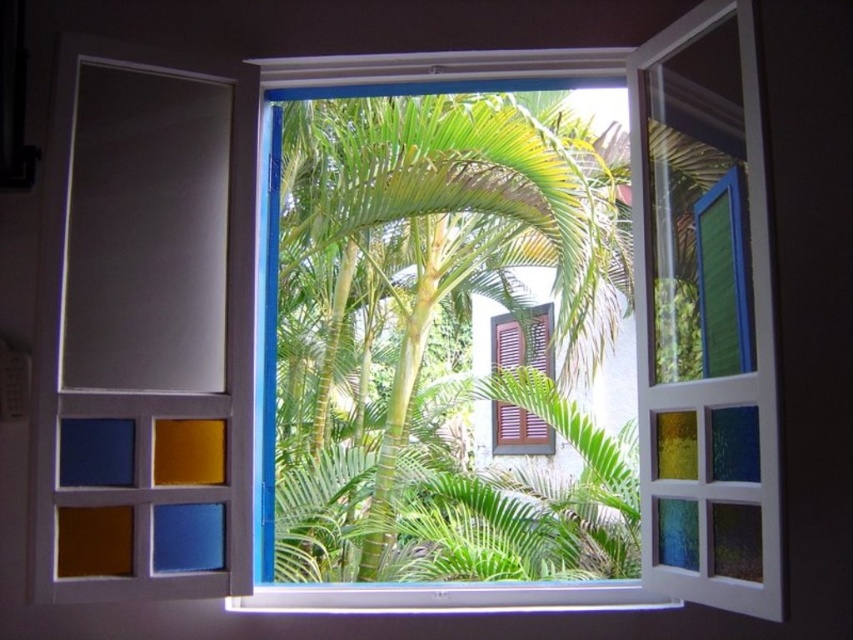
Question: Which object is positioned closest to the matte glass shutter at left?

Choices:
 (A) green leafy palm tree at center
 (B) white plastic window sill at lower center

Answer: (B)

Question: Is matte glass shutter at left closer to camera compared to white plastic window sill at lower center?

Choices:
 (A) no
 (B) yes

Answer: (B)

Question: Is green leafy palm tree at center wider than matte glass shutter at left?

Choices:
 (A) no
 (B) yes

Answer: (B)

Question: Can you confirm if green leafy palm tree at center is positioned above matte glass shutter at left?

Choices:
 (A) yes
 (B) no

Answer: (A)

Question: Which of the following is the closest to the observer?

Choices:
 (A) (167, 444)
 (B) (469, 586)
 (C) (514, 452)

Answer: (A)

Question: Estimate the real-world distances between objects in this image. Which object is farther from the matte glass shutter at left?

Choices:
 (A) green leafy palm tree at center
 (B) white plastic window sill at lower center
 (C) brown wooden shutter at center

Answer: (C)